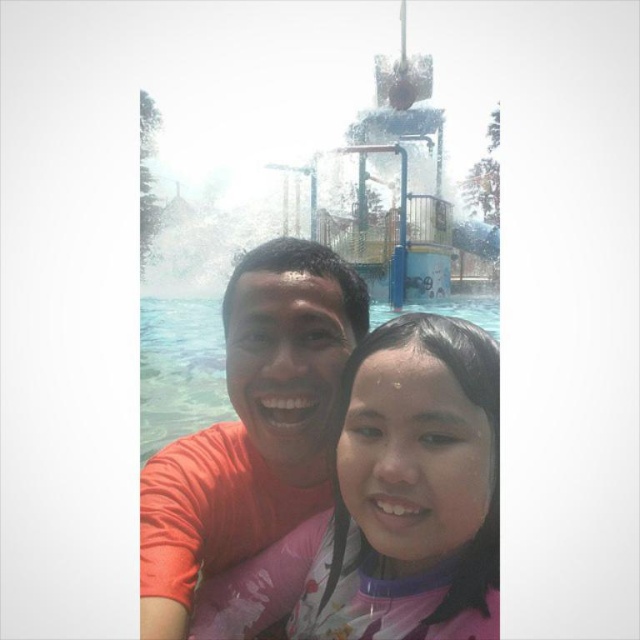
You are standing at the point marked by the coordinates point (390,504) in the image. What object is located at that exact point?

The point (390,504) indicates pink fabric at center.

You are standing at the water park and want to take a photo of the two people in the foreground. You notice two points marked in the image. Which point, point [468,605] or point [211,416], is closer to you?

Point [468,605] is closer to the viewer than point [211,416].